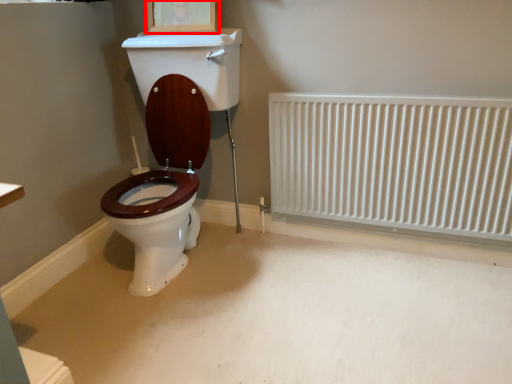
Question: From the image, what is the correct spatial relationship of picture frame (annotated by the red box) in relation to radiator?

Choices:
 (A) left
 (B) right

Answer: (A)